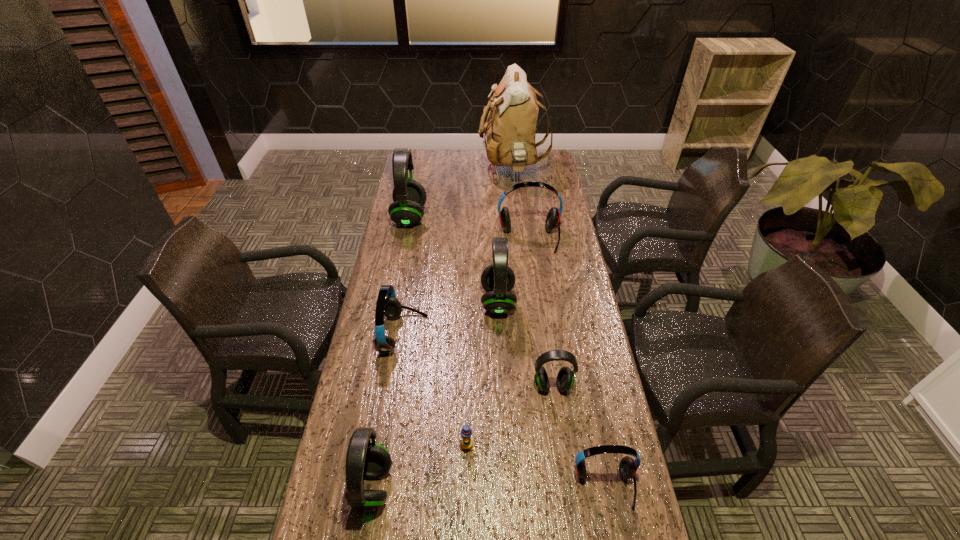
Where is `vacant area in the image that satisfies the following two spatial constraints: 1. with the microphone attached to the side of the biggest red headset; 2. on the ear cups of the nearest black headset`? vacant area in the image that satisfies the following two spatial constraints: 1. with the microphone attached to the side of the biggest red headset; 2. on the ear cups of the nearest black headset is located at coordinates (561, 487).

Locate an element on the screen. The image size is (960, 540). blank space that satisfies the following two spatial constraints: 1. on the front-facing side of the brown backpack; 2. on the face of the shortest object, where the monocle is placed is located at coordinates (540, 446).

The image size is (960, 540). What are the coordinates of `blank area in the image that satisfies the following two spatial constraints: 1. on the ear cups of the second black headset from right to left; 2. on the face of the sixth object from right to left, where the monocle is placed` in the screenshot? It's located at (504, 446).